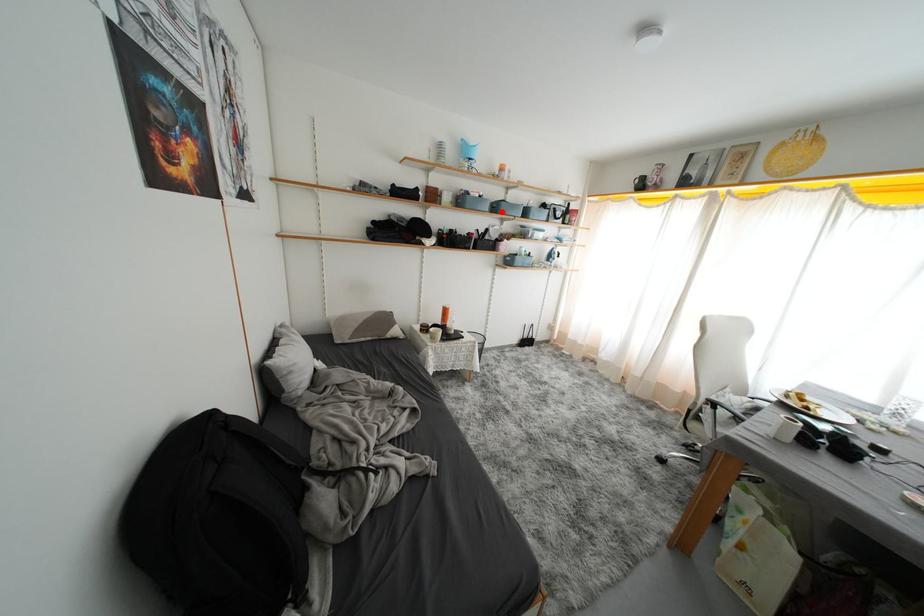
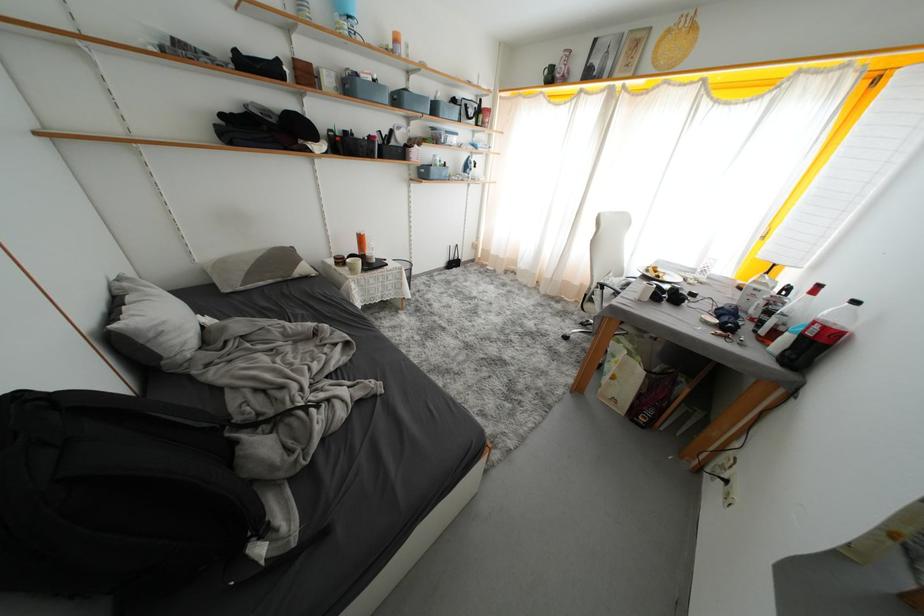
Locate, in the second image, the point that corresponds to the highlighted location in the first image.

(404, 103)